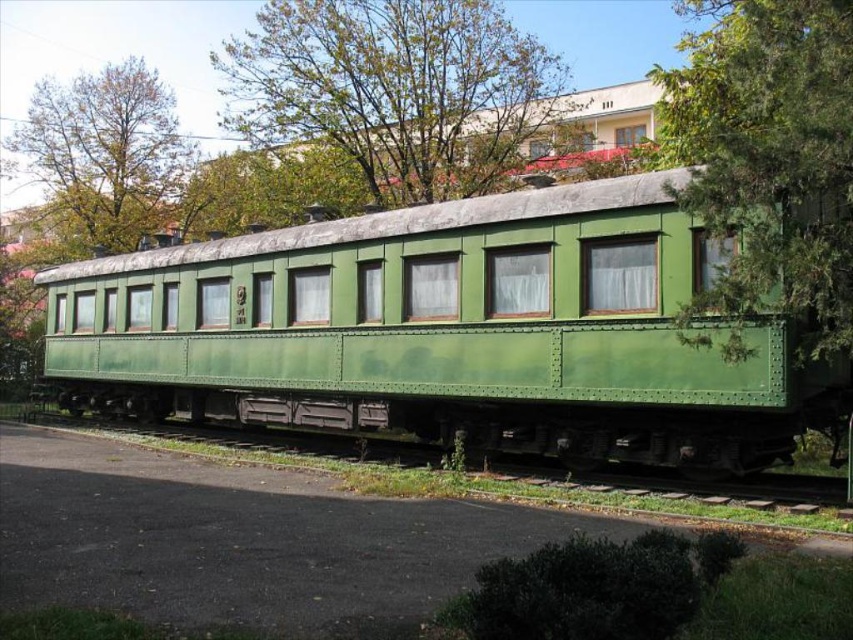
Question: Does green matte train car at center have a lesser width compared to green leafy tree at upper left?

Choices:
 (A) no
 (B) yes

Answer: (A)

Question: Which object appears farthest from the camera in this image?

Choices:
 (A) green matte train car at center
 (B) green textured tree at upper right

Answer: (A)

Question: Is green leafy tree at upper center closer to the viewer compared to green leafy tree at upper left?

Choices:
 (A) yes
 (B) no

Answer: (A)

Question: Which object is farther from the camera taking this photo?

Choices:
 (A) green leafy tree at upper center
 (B) green textured tree at upper right

Answer: (A)

Question: Does green matte train car at center come in front of green leafy tree at upper center?

Choices:
 (A) no
 (B) yes

Answer: (B)

Question: Among these points, which one is nearest to the camera?

Choices:
 (A) (137, 61)
 (B) (410, 29)
 (C) (799, 36)

Answer: (C)